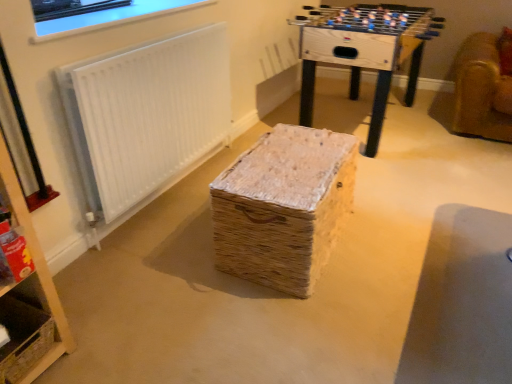
This screenshot has width=512, height=384. Find the location of `spots to the right of woven straw basket at center`. spots to the right of woven straw basket at center is located at coordinates (399, 253).